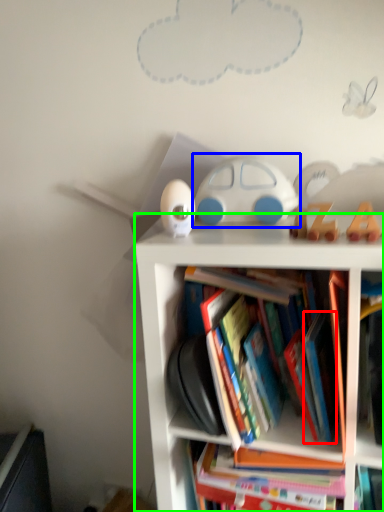
Question: Based on their relative distances, which object is nearer to paperback book (highlighted by a red box)? Choose from toy (highlighted by a blue box) and bookcase (highlighted by a green box).

Choices:
 (A) toy
 (B) bookcase

Answer: (B)